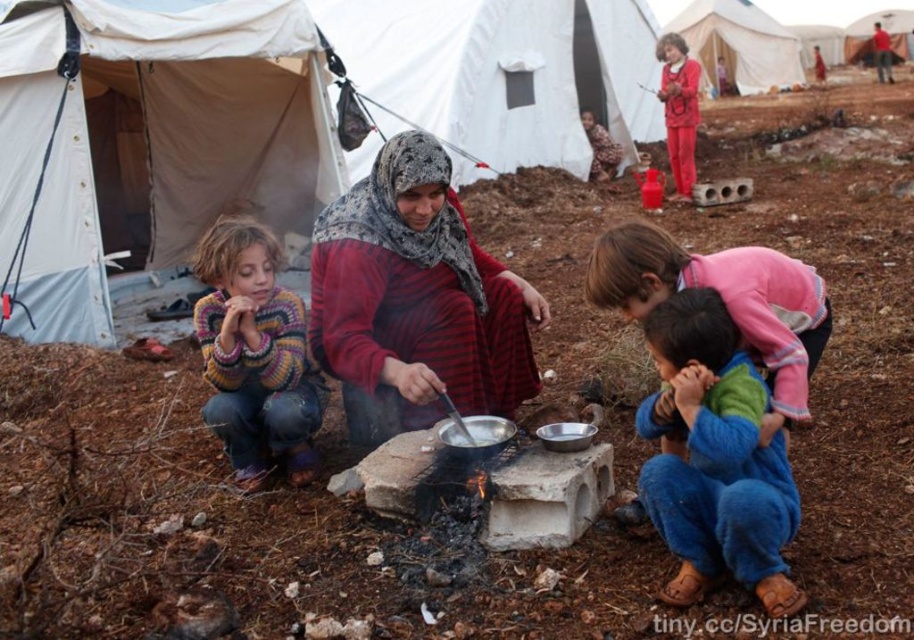
Does blue denim pants at lower right come behind pink fleece jacket at center?

No, blue denim pants at lower right is closer to the viewer.

In order to click on blue denim pants at lower right in this screenshot , I will do `click(714, 458)`.

Is point (487, 392) behind point (780, 307)?

Yes, point (487, 392) is farther from viewer.

Is point (471, 326) positioned before point (622, 291)?

No, (471, 326) is further to viewer.

Is point (462, 264) behind point (641, 289)?

Yes, point (462, 264) is farther from viewer.

You are a GUI agent. You are given a task and a screenshot of the screen. Output one action in this format:
    pyautogui.click(x=<x>, y=<y>)
    Task: Click on the red striped fabric at center
    The height and width of the screenshot is (640, 914).
    Given the screenshot: What is the action you would take?
    pyautogui.click(x=415, y=300)

Does point (112, 6) come behind point (796, 56)?

No, it is in front of (796, 56).

Identify the location of white canvas tent at left. (149, 141).